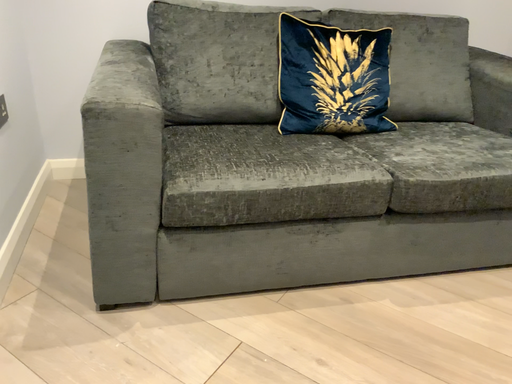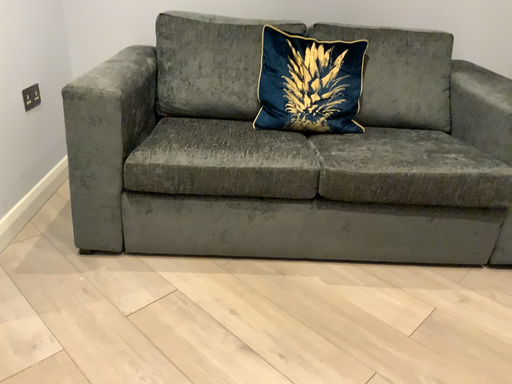
Question: Which way did the camera rotate in the video?

Choices:
 (A) rotated right
 (B) rotated left

Answer: (B)